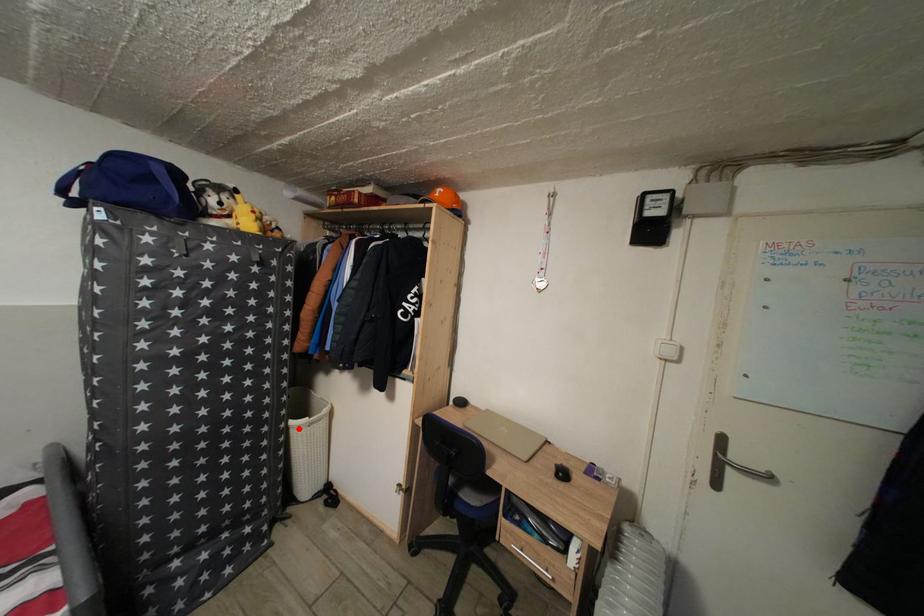
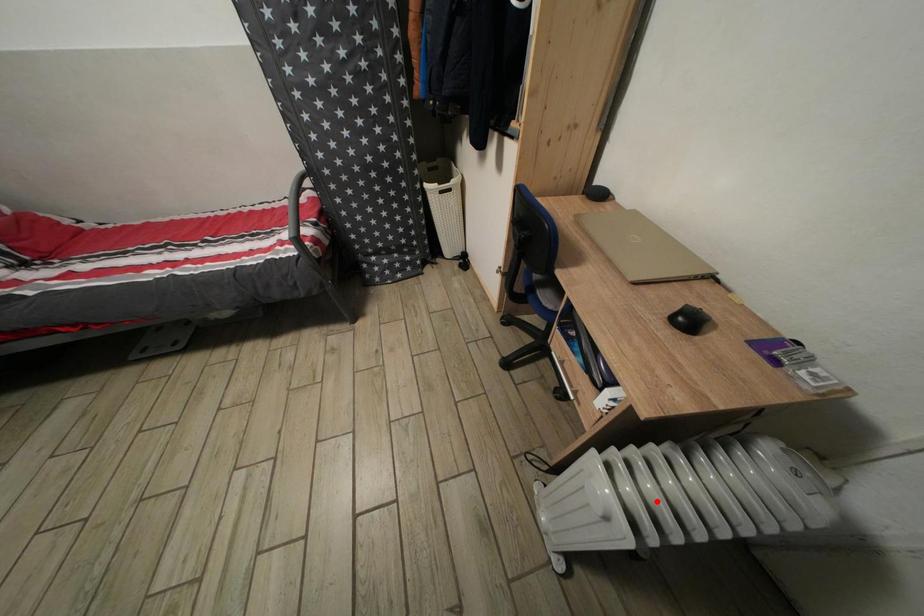
I am providing you with two images of the same scene from different viewpoints. A red point is marked on the first image and another point is marked on the second image. Is the red point in image1 aligned with the point shown in image2?

No